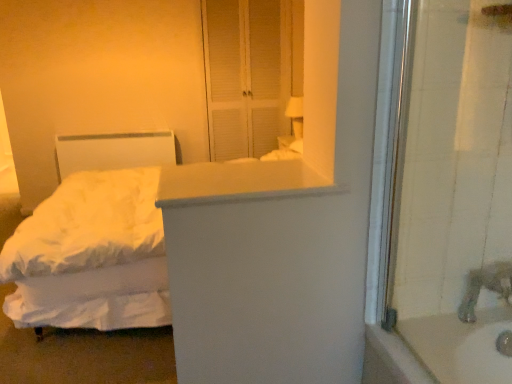
You are a GUI agent. You are given a task and a screenshot of the screen. Output one action in this format:
    pyautogui.click(x=<x>, y=<y>)
    Task: Click on the silver metallic faucet at lower right
    
    Given the screenshot: What is the action you would take?
    pyautogui.click(x=486, y=287)

I want to click on white soft bed at left, so click(94, 241).

From the image's perspective, is silver metallic faucet at lower right over white matte counter top at center?

Actually, silver metallic faucet at lower right appears below white matte counter top at center in the image.

How different are the orientations of silver metallic faucet at lower right and white matte counter top at center in degrees?

The angular difference between silver metallic faucet at lower right and white matte counter top at center is 88.4 degrees.

How distant is silver metallic faucet at lower right from white matte counter top at center?

silver metallic faucet at lower right is 71.01 centimeters from white matte counter top at center.

Does silver metallic faucet at lower right lie behind white matte counter top at center?

Yes, silver metallic faucet at lower right is further from the camera.

How many degrees apart are the facing directions of white matte screen door at upper center and white matte counter top at center?

The angle between the facing direction of white matte screen door at upper center and the facing direction of white matte counter top at center is 89.1 degrees.

Which is more to the right, white matte screen door at upper center or white matte counter top at center?

From the viewer's perspective, white matte counter top at center appears more on the right side.

Which object is further away from the camera, white matte screen door at upper center or white matte counter top at center?

white matte screen door at upper center is more distant.

Considering the sizes of objects white matte screen door at upper center and white matte counter top at center in the image provided, who is thinner, white matte screen door at upper center or white matte counter top at center?

white matte screen door at upper center.

Considering the sizes of white soft bed at left and white matte counter top at center in the image, is white soft bed at left taller or shorter than white matte counter top at center?

white soft bed at left is taller than white matte counter top at center.

Considering the sizes of objects white soft bed at left and white matte counter top at center in the image provided, who is wider, white soft bed at left or white matte counter top at center?

Wider between the two is white soft bed at left.

Which is more to the right, white soft bed at left or white matte counter top at center?

From the viewer's perspective, white matte counter top at center appears more on the right side.

From the image's perspective, who appears lower, white matte counter top at center or white matte screen door at upper center?

white matte counter top at center appears lower in the image.

Is there a large distance between white matte counter top at center and white matte screen door at upper center?

white matte counter top at center is far away from white matte screen door at upper center.

Between point (199, 182) and point (273, 35), which one is positioned behind?

Point (273, 35)

Considering the sizes of objects white matte counter top at center and white matte screen door at upper center in the image provided, who is bigger, white matte counter top at center or white matte screen door at upper center?

With larger size is white matte screen door at upper center.

From the image's perspective, would you say white matte screen door at upper center is shown under silver metallic faucet at lower right?

Incorrect, from the image's perspective, white matte screen door at upper center is higher than silver metallic faucet at lower right.

Which is in front, white matte screen door at upper center or silver metallic faucet at lower right?

silver metallic faucet at lower right is more forward.

Is white matte screen door at upper center not near silver metallic faucet at lower right?

Indeed, white matte screen door at upper center is not near silver metallic faucet at lower right.

Is white matte counter top at center to the left or to the right of white soft bed at left in the image?

Clearly, white matte counter top at center is on the right of white soft bed at left in the image.

Which of these two, white matte counter top at center or white soft bed at left, is wider?

white soft bed at left is wider.

Is white matte counter top at center positioned with its back to white soft bed at left?

No.

Who is smaller, white matte counter top at center or white soft bed at left?

white matte counter top at center.

Is silver metallic faucet at lower right positioned with its back to white matte screen door at upper center?

Correct, silver metallic faucet at lower right is looking away from white matte screen door at upper center.

Is the depth of silver metallic faucet at lower right greater than that of white matte screen door at upper center?

No, silver metallic faucet at lower right is closer to the viewer.

Is silver metallic faucet at lower right wider or thinner than white matte screen door at upper center?

Considering their sizes, silver metallic faucet at lower right looks broader than white matte screen door at upper center.

Locate an element on the screen. This screenshot has width=512, height=384. counter top above the silver metallic faucet at lower right (from a real-world perspective) is located at coordinates (238, 182).

The image size is (512, 384). Identify the location of screen door behind the white matte counter top at center. (247, 74).

Estimate the real-world distances between objects in this image. Which object is closer to white soft bed at left, silver metallic faucet at lower right or white matte counter top at center?

white matte counter top at center lies closer to white soft bed at left than the other object.

Which object lies further to the anchor point white matte counter top at center, white matte screen door at upper center or silver metallic faucet at lower right?

white matte screen door at upper center lies further to white matte counter top at center than the other object.

Estimate the real-world distances between objects in this image. Which object is further from white soft bed at left, silver metallic faucet at lower right or white matte screen door at upper center?

→ white matte screen door at upper center.

From the image, which object appears to be nearer to white soft bed at left, white matte counter top at center or silver metallic faucet at lower right?

The object closer to white soft bed at left is white matte counter top at center.

Based on their spatial positions, is white matte screen door at upper center or white matte counter top at center further from silver metallic faucet at lower right?

white matte screen door at upper center is further to silver metallic faucet at lower right.

Which object lies further to the anchor point white matte screen door at upper center, white matte counter top at center or white soft bed at left?

The object further to white matte screen door at upper center is white matte counter top at center.

Estimate the real-world distances between objects in this image. Which object is further from white matte counter top at center, white matte screen door at upper center or white soft bed at left?

Based on the image, white matte screen door at upper center appears to be further to white matte counter top at center.

From the picture: Estimate the real-world distances between objects in this image. Which object is further from silver metallic faucet at lower right, white matte counter top at center or white soft bed at left?

white soft bed at left lies further to silver metallic faucet at lower right than the other object.

Image resolution: width=512 pixels, height=384 pixels. I want to click on bed between silver metallic faucet at lower right and white matte screen door at upper center in the front-back direction, so click(94, 241).

Locate an element on the screen. The image size is (512, 384). counter top between white soft bed at left and silver metallic faucet at lower right is located at coordinates (238, 182).

This screenshot has width=512, height=384. What are the coordinates of `bed positioned between white matte counter top at center and white matte screen door at upper center from near to far` in the screenshot? It's located at (94, 241).

In order to click on faucet located between white matte counter top at center and white matte screen door at upper center in the depth direction in this screenshot , I will do `click(486, 287)`.